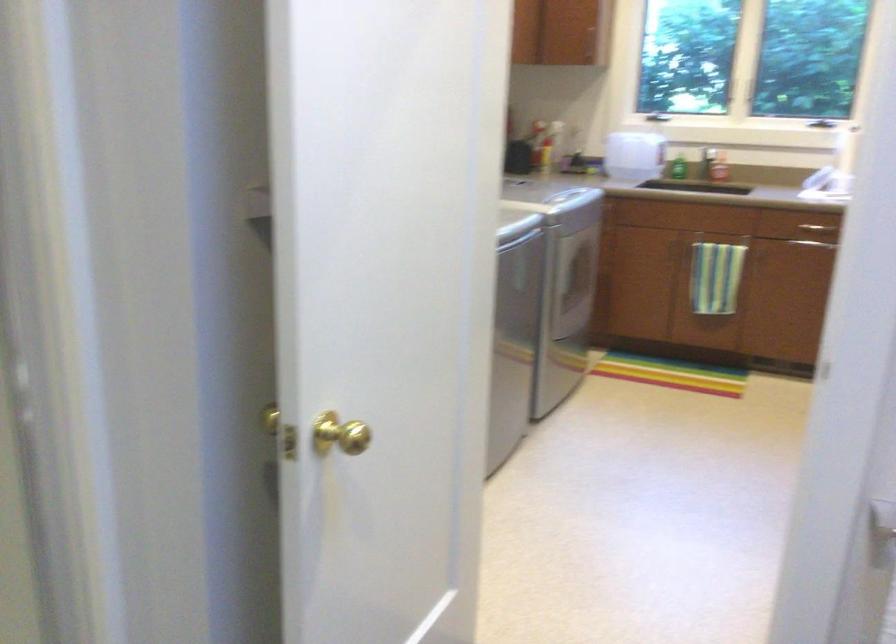
The height and width of the screenshot is (644, 896). What do you see at coordinates (339, 433) in the screenshot? I see `the gold door knob` at bounding box center [339, 433].